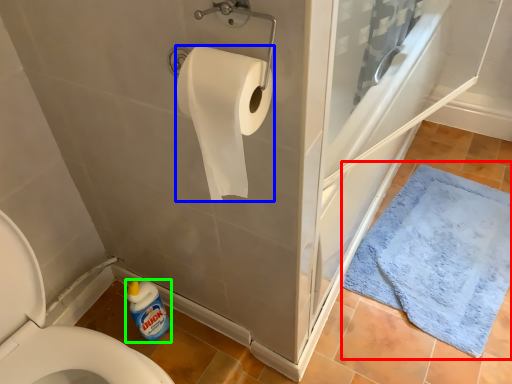
Question: Based on their relative distances, which object is farther from bath mat (highlighted by a red box)? Choose from toilet paper (highlighted by a blue box) and cleaning product (highlighted by a green box).

Choices:
 (A) toilet paper
 (B) cleaning product

Answer: (A)